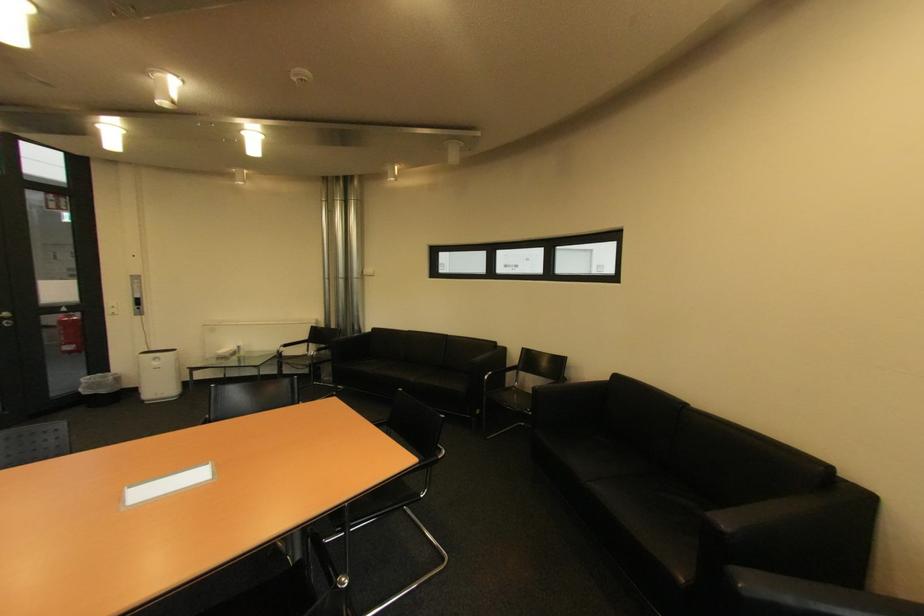
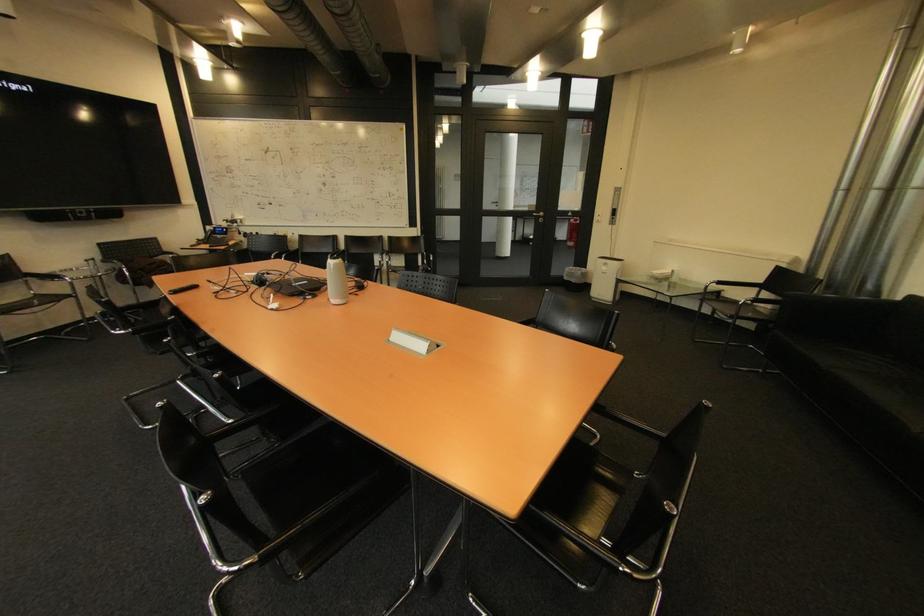
The point at [164,363] is marked in the first image. Where is the corresponding point in the second image?

(613, 270)